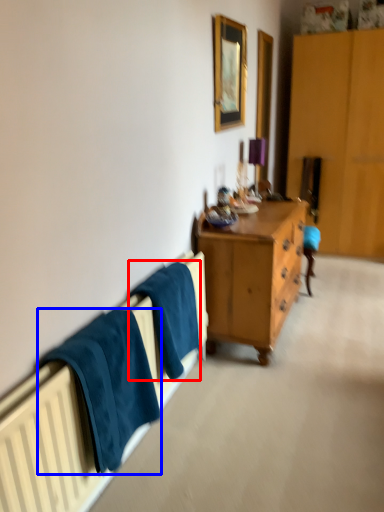
Question: Which object appears farthest to the camera in this image, bath towel (highlighted by a red box) or towel/napkin (highlighted by a blue box)?

Choices:
 (A) bath towel
 (B) towel/napkin

Answer: (A)